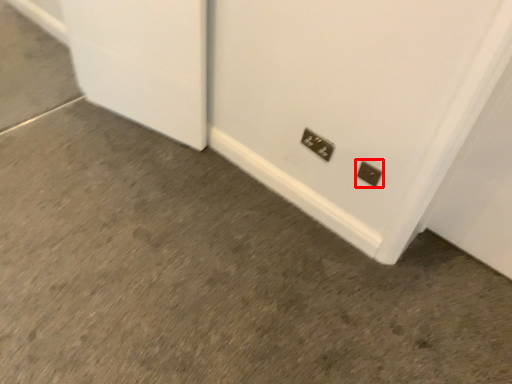
Question: Observing the image, what is the correct spatial positioning of power plugs and sockets (annotated by the red box) in reference to power plugs and sockets?

Choices:
 (A) right
 (B) left

Answer: (A)